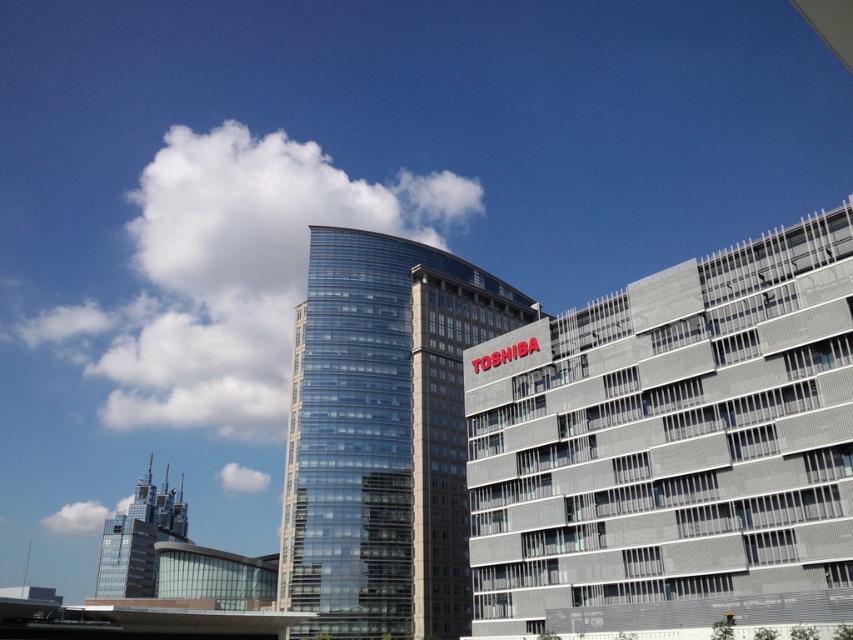
Is gray metallic building at upper right thinner than glassy skyscraper at left?

Yes.

Can you confirm if gray metallic building at upper right is bigger than glassy skyscraper at left?

No, gray metallic building at upper right is not bigger than glassy skyscraper at left.

Find the location of a particular element. Image resolution: width=853 pixels, height=640 pixels. gray metallic building at upper right is located at coordinates (669, 436).

The image size is (853, 640). Identify the location of gray metallic building at upper right. (669, 436).

Does transparent glass building at center have a larger size compared to glassy skyscraper at left?

No.

Who is positioned more to the left, transparent glass building at center or glassy skyscraper at left?

Positioned to the left is glassy skyscraper at left.

Who is more distant from viewer, (437,609) or (136,556)?

The point (136,556) is behind.

Identify the location of transparent glass building at center. The height and width of the screenshot is (640, 853). (381, 435).

Can you confirm if gray metallic building at upper right is positioned above transparent glass building at center?

No.

Is the position of gray metallic building at upper right less distant than that of transparent glass building at center?

Yes, gray metallic building at upper right is closer to the viewer.

Between point (625, 449) and point (346, 458), which one is positioned behind?

The point (346, 458) is more distant.

Find the location of a particular element. The height and width of the screenshot is (640, 853). gray metallic building at upper right is located at coordinates (669, 436).